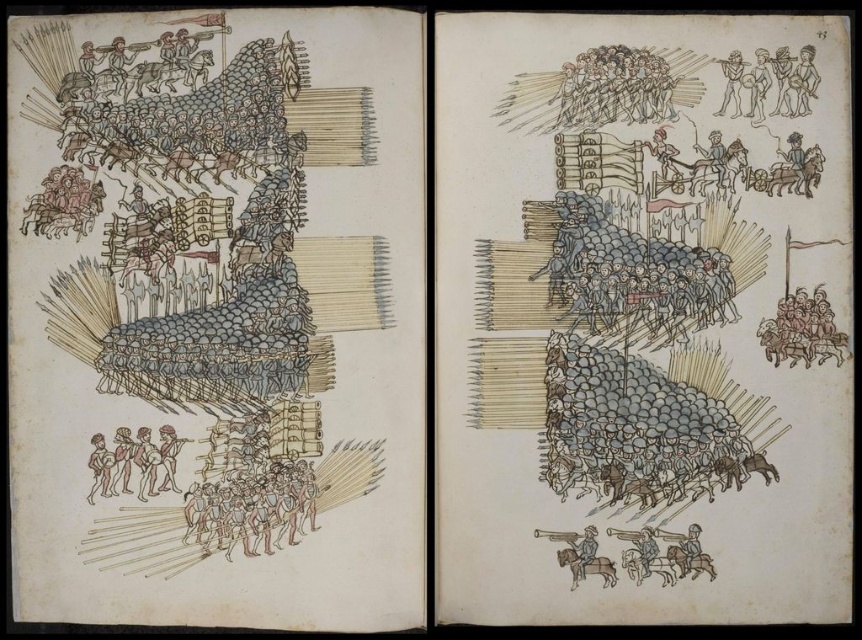
Which is below, brown leather boots at lower left or brown leather armor at lower right?

brown leather armor at lower right is below.

In the scene shown: Between brown leather boots at lower left and brown leather armor at lower right, which one has more height?

With more height is brown leather boots at lower left.

Find the location of a particular element. The height and width of the screenshot is (640, 862). brown leather boots at lower left is located at coordinates (134, 461).

Which is in front, point (776, 518) or point (648, 552)?

Positioned in front is point (776, 518).

Between brown wood cart at upper center and brown leather armor at lower right, which one has less height?

brown leather armor at lower right

Measure the distance between point (x=820, y=586) and camera.

Point (x=820, y=586) is 3.80 feet from camera.

Locate an element on the screen. This screenshot has width=862, height=640. brown wood cart at upper center is located at coordinates (642, 324).

Is brown wood soldiers at upper center in front of brown leather boots at lower left?

Yes, it is.

Describe the element at coordinates (217, 316) in the screenshot. I see `brown wood soldiers at upper center` at that location.

You are a GUI agent. You are given a task and a screenshot of the screen. Output one action in this format:
    pyautogui.click(x=<x>, y=<y>)
    Task: Click on the brown wood soldiers at upper center
    This screenshot has width=862, height=640.
    Given the screenshot: What is the action you would take?
    pyautogui.click(x=217, y=316)

Find the location of a particular element. This screenshot has width=862, height=640. brown wood soldiers at upper center is located at coordinates (217, 316).